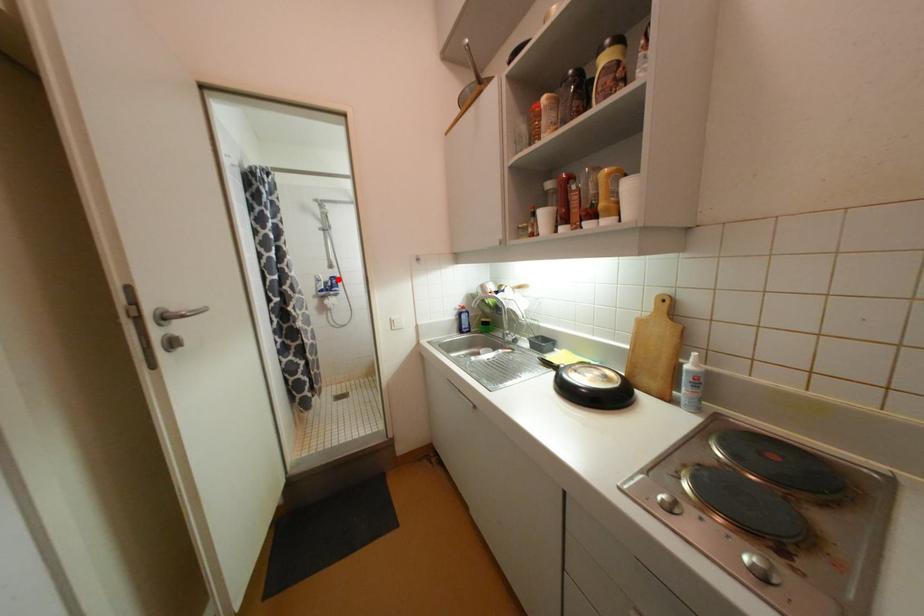
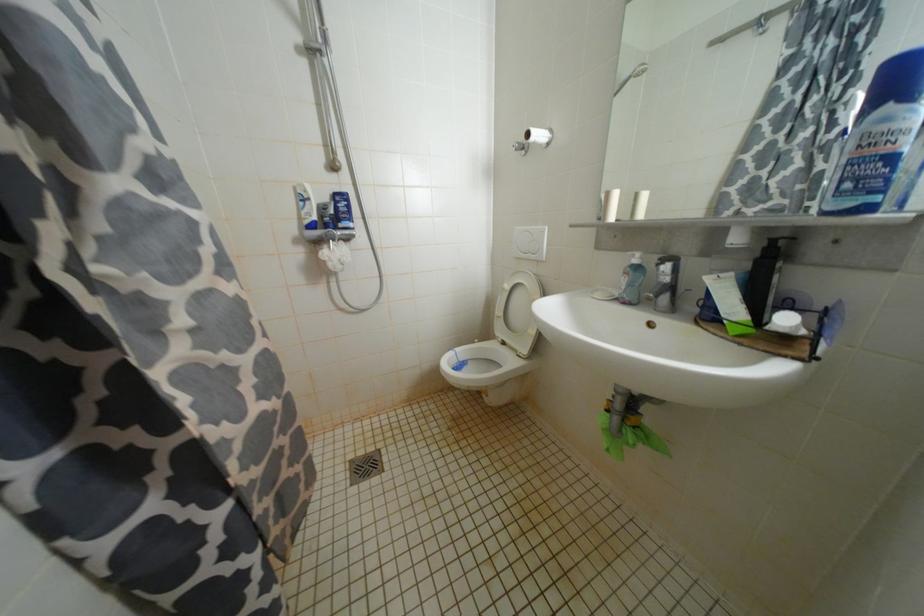
Where in the second image is the point corresponding to the highlighted location from the first image?

(345, 198)